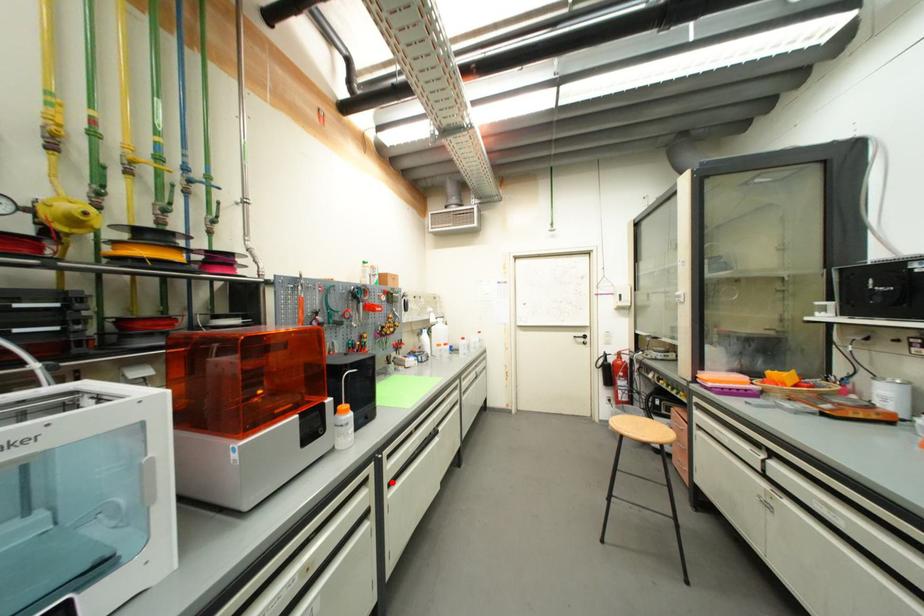
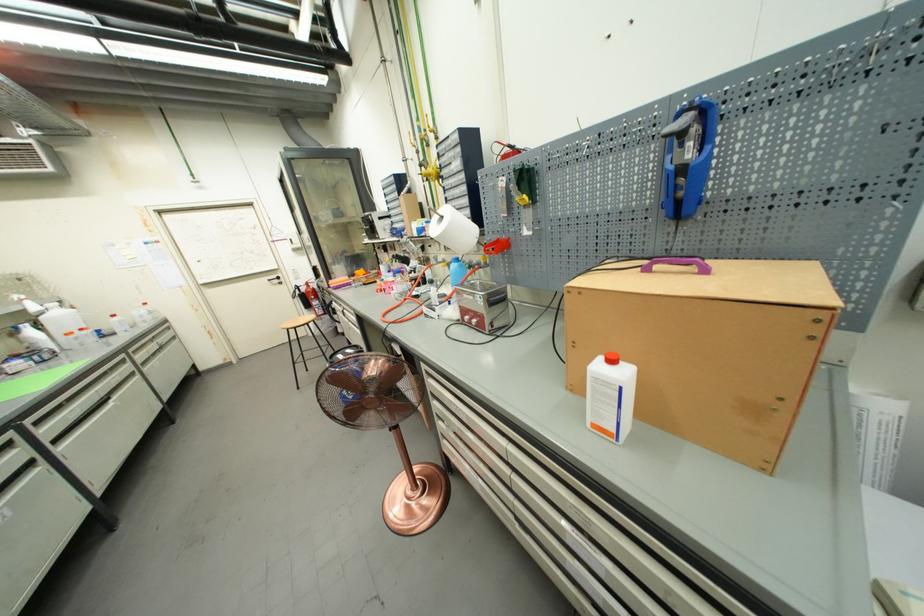
Find the pixel in the second image that matches the highlighted location in the first image.

(52, 440)